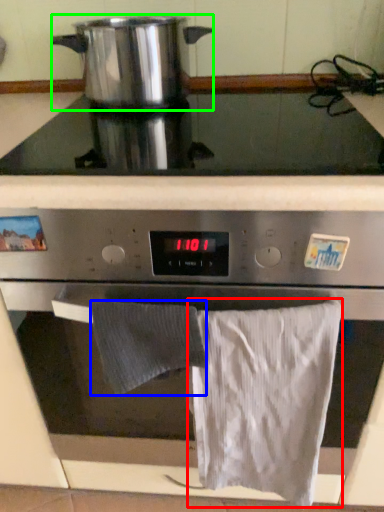
Question: Estimate the real-world distances between objects in this image. Which object is farther from bath towel (highlighted by a red box), bath towel (highlighted by a blue box) or kitchen appliance (highlighted by a green box)?

Choices:
 (A) bath towel
 (B) kitchen appliance

Answer: (B)